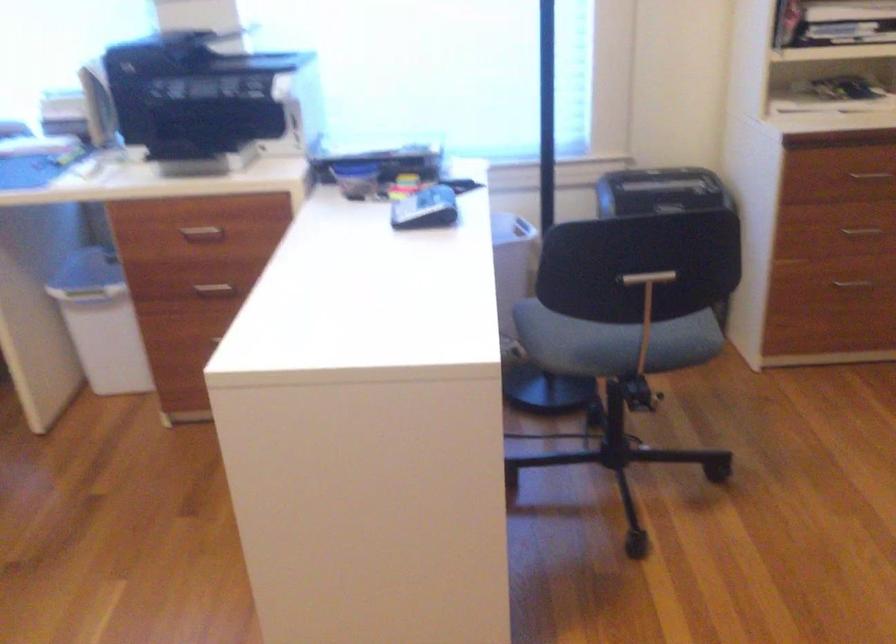
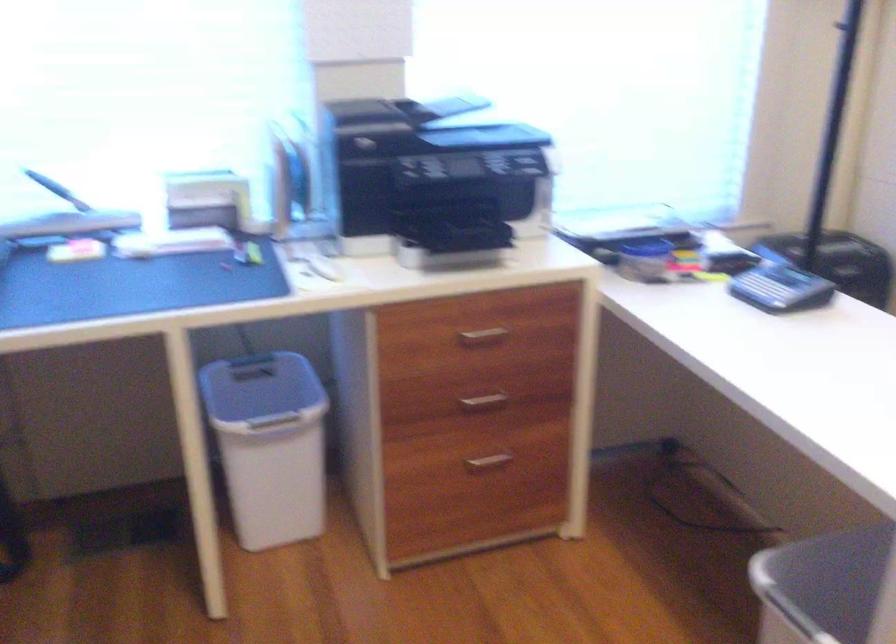
In the second image, find the point that corresponds to (211,229) in the first image.

(483, 334)